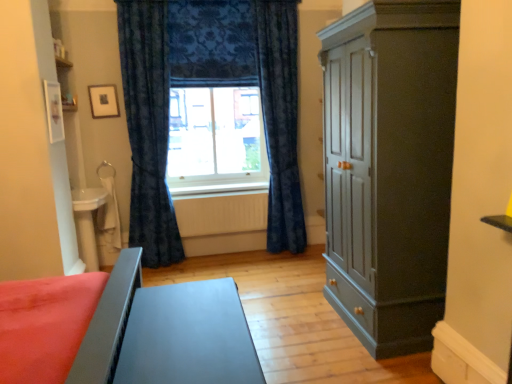
I want to click on velvet dark blue curtain at center, which is the first curtain in right-to-left order, so pos(280,119).

Find the location of a particular element. matte gray table at center, acting as the 2th table starting from the back is located at coordinates (188, 336).

In order to face matte gray table at center, which ranks as the 1th table in right-to-left order, should I rotate leftwards or rightwards?

Rotate left and turn 8.109 degrees.

What do you see at coordinates (389, 168) in the screenshot?
I see `matte dark gray cupboard at right` at bounding box center [389, 168].

Measure the distance between white painted wood at center and camera.

white painted wood at center and camera are 4.07 meters apart.

The width and height of the screenshot is (512, 384). What do you see at coordinates (103, 101) in the screenshot?
I see `wooden picture frame at upper left` at bounding box center [103, 101].

At what (x,y) coordinates should I click in order to perform the action: click on yellow matte radiator at center. Please return your answer as a coordinate pair (x, y). This screenshot has width=512, height=384. Looking at the image, I should click on (221, 213).

Measure the distance between velvet dark blue curtain at center, the 1th curtain from the left, and camera.

A distance of 3.72 meters exists between velvet dark blue curtain at center, the 1th curtain from the left, and camera.

What do you see at coordinates (148, 128) in the screenshot? I see `velvet dark blue curtain at center, the 1th curtain from the left` at bounding box center [148, 128].

Locate an element on the screen. Image resolution: width=512 pixels, height=384 pixels. velvet dark blue curtain at center, which is the first curtain in right-to-left order is located at coordinates (280, 119).

From the image's perspective, is velvet dark blue curtain at center, the second curtain viewed from the right, over yellow matte radiator at center?

Yes, from the image's perspective, velvet dark blue curtain at center, the second curtain viewed from the right, is on top of yellow matte radiator at center.

Is the depth of velvet dark blue curtain at center, the 1th curtain from the left, greater than that of yellow matte radiator at center?

No, velvet dark blue curtain at center, the 1th curtain from the left, is closer to the viewer.

Considering the sizes of velvet dark blue curtain at center, the 1th curtain from the left, and yellow matte radiator at center in the image, is velvet dark blue curtain at center, the 1th curtain from the left, taller or shorter than yellow matte radiator at center?

In the image, velvet dark blue curtain at center, the 1th curtain from the left, appears to be taller than yellow matte radiator at center.

Considering the sizes of objects velvet dark blue curtain at center, the second curtain viewed from the right, and yellow matte radiator at center in the image provided, who is smaller, velvet dark blue curtain at center, the second curtain viewed from the right, or yellow matte radiator at center?

Smaller between the two is yellow matte radiator at center.

Can you confirm if white painted wood at center is wider than velvet dark blue curtain at center, the second curtain viewed from the right?

No.

You are a GUI agent. You are given a task and a screenshot of the screen. Output one action in this format:
    pyautogui.click(x=<x>, y=<y>)
    Task: Click on the curtain that is the 1st object located above the white painted wood at center (from the image's perspective)
    The width and height of the screenshot is (512, 384).
    Given the screenshot: What is the action you would take?
    pyautogui.click(x=148, y=128)

Consider the image. Is white painted wood at center touching velvet dark blue curtain at center, the second curtain viewed from the right?

No, white painted wood at center is not with velvet dark blue curtain at center, the second curtain viewed from the right.

Looking at this image, how different are the orientations of white painted wood at center and velvet dark blue curtain at center, the 1th curtain from the left, in degrees?

The facing directions of white painted wood at center and velvet dark blue curtain at center, the 1th curtain from the left, are 0.754 degrees apart.

Is yellow matte radiator at center aimed at matte dark gray cupboard at right?

No.

From the image's perspective, which one is positioned lower, yellow matte radiator at center or matte dark gray cupboard at right?

yellow matte radiator at center, from the image's perspective.

Is point (198, 233) positioned in front of point (327, 236)?

No.

Considering the sizes of yellow matte radiator at center and matte dark gray cupboard at right in the image, is yellow matte radiator at center wider or thinner than matte dark gray cupboard at right?

Clearly, yellow matte radiator at center has less width compared to matte dark gray cupboard at right.

Measure the distance between matte gray table at center, acting as the 2th table starting from the back, and matte dark gray cupboard at right.

They are 1.14 meters apart.

From the image's perspective, does matte gray table at center, which is the second table in left-to-right order, appear higher than matte dark gray cupboard at right?

Actually, matte gray table at center, which is the second table in left-to-right order, appears below matte dark gray cupboard at right in the image.

Considering the relative sizes of matte gray table at center, which is the second table in left-to-right order, and matte dark gray cupboard at right in the image provided, is matte gray table at center, which is the second table in left-to-right order, bigger than matte dark gray cupboard at right?

No, matte gray table at center, which is the second table in left-to-right order, is not bigger than matte dark gray cupboard at right.

From a real-world perspective, who is located higher, matte gray table at center, which is the second table in left-to-right order, or matte dark gray cupboard at right?

matte dark gray cupboard at right is physically above.

What's the angular difference between white painted wood at center and wooden picture frame at upper left's facing directions?

There is a 0.15-degree angle between the facing directions of white painted wood at center and wooden picture frame at upper left.

Is white painted wood at center looking in the opposite direction of wooden picture frame at upper left?

No, white painted wood at center's orientation is not away from wooden picture frame at upper left.

Is white painted wood at center bigger or smaller than wooden picture frame at upper left?

Clearly, white painted wood at center is larger in size than wooden picture frame at upper left.

Is white painted wood at center outside of wooden picture frame at upper left?

Yes, white painted wood at center is located beyond the bounds of wooden picture frame at upper left.

From a real-world perspective, which object stands above the other?

velvet dark blue curtain at center, the 1th curtain from the left, from a real-world perspective.

Which is correct: velvet dark blue curtain at center, the 1th curtain from the left, is inside matte gray table at center, which is the second table in left-to-right order, or outside of it?

velvet dark blue curtain at center, the 1th curtain from the left, is not inside matte gray table at center, which is the second table in left-to-right order, it's outside.

Is point (161, 52) positioned behind point (164, 326)?

Yes, it is behind point (164, 326).

Is matte gray table at center, which is the second table in left-to-right order, at the back of velvet dark blue curtain at center, the second curtain viewed from the right?

No, velvet dark blue curtain at center, the second curtain viewed from the right,'s orientation is not away from matte gray table at center, which is the second table in left-to-right order.

Is velvet dark blue curtain at center, the 1th curtain from the left, wider than velvet blue curtain at center?

Yes.

Which is nearer, (163, 219) or (215, 133)?

Point (163, 219) is closer to the camera than point (215, 133).

Is velvet dark blue curtain at center, the second curtain viewed from the right, turned away from velvet blue curtain at center?

That's not correct — velvet dark blue curtain at center, the second curtain viewed from the right, is not looking away from velvet blue curtain at center.

Locate an element on the screen. radiator lying below the velvet dark blue curtain at center, the second curtain viewed from the right (from the image's perspective) is located at coordinates (221, 213).

Starting from the white painted wood at center, which curtain is the 2nd one in front? Please provide its 2D coordinates.

[(148, 128)]

Which object lies nearer to the anchor point matte dark gray cupboard at right, yellow matte radiator at center or velvet blue curtain at center?

Based on the image, yellow matte radiator at center appears to be nearer to matte dark gray cupboard at right.

Which object lies further to the anchor point yellow matte radiator at center, white painted wood at center or wooden picture frame at upper left?

Based on the image, wooden picture frame at upper left appears to be further to yellow matte radiator at center.

Estimate the real-world distances between objects in this image. Which object is further from white painted wood at center, velvet blue curtain at center or velvet dark blue curtain at center, the second curtain viewed from the right?

velvet dark blue curtain at center, the second curtain viewed from the right, is further to white painted wood at center.

From the image, which object appears to be farther from velvet dark blue curtain at center, which is the first curtain in right-to-left order, matte gray table at center, marked as the 1th table in a front-to-back arrangement, or velvet blue curtain at center?

matte gray table at center, marked as the 1th table in a front-to-back arrangement, is further to velvet dark blue curtain at center, which is the first curtain in right-to-left order.

Based on their spatial positions, is velvet blue curtain at center or matte gray table at lower left, arranged as the 1th table when viewed from the back, further from velvet dark blue curtain at center, the second curtain viewed from the right?

velvet blue curtain at center is further to velvet dark blue curtain at center, the second curtain viewed from the right.

When comparing their distances from wooden picture frame at upper left, does velvet dark blue curtain at center, which ranks as the second curtain in left-to-right order, or yellow matte radiator at center seem further?

Among the two, velvet dark blue curtain at center, which ranks as the second curtain in left-to-right order, is located further to wooden picture frame at upper left.

Based on their spatial positions, is matte dark gray cupboard at right or yellow matte radiator at center closer to velvet dark blue curtain at center, which ranks as the second curtain in left-to-right order?

yellow matte radiator at center is positioned closer to the anchor velvet dark blue curtain at center, which ranks as the second curtain in left-to-right order.

Based on their spatial positions, is velvet dark blue curtain at center, the 1th curtain from the left, or matte gray table at center, which is the second table in left-to-right order, further from yellow matte radiator at center?

matte gray table at center, which is the second table in left-to-right order.

Locate an element on the screen. Image resolution: width=512 pixels, height=384 pixels. table located between matte gray table at center, acting as the 2th table starting from the back, and velvet blue curtain at center in the depth direction is located at coordinates (87, 222).

Where is `window positioned between matte dark gray cupboard at right and white painted wood at center from near to far`? The image size is (512, 384). window positioned between matte dark gray cupboard at right and white painted wood at center from near to far is located at coordinates (x=216, y=141).

At what (x,y) coordinates should I click in order to perform the action: click on window sill between matte gray table at lower left, the second table viewed from the right, and velvet dark blue curtain at center, which ranks as the second curtain in left-to-right order, in the horizontal direction. Please return your answer as a coordinate pair (x, y). The height and width of the screenshot is (384, 512). Looking at the image, I should click on tap(219, 188).

You are a GUI agent. You are given a task and a screenshot of the screen. Output one action in this format:
    pyautogui.click(x=<x>, y=<y>)
    Task: Click on the radiator between velvet blue curtain at center and matte gray table at lower left, positioned as the 1th table in left-to-right order, in the vertical direction
    This screenshot has width=512, height=384.
    Given the screenshot: What is the action you would take?
    pyautogui.click(x=221, y=213)